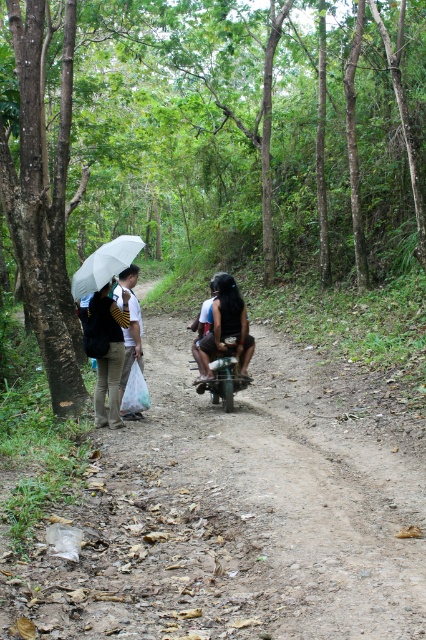
You are standing at the point labeled as point [238,512] in the image. What is the object directly beneath your feet?

The point labeled as point [238,512] corresponds to the dirt road at center.

You are a hiker who just arrived at the dirt road at center. You see a white matte bag at left. Which object is larger in size?

The dirt road at center is bigger than white matte bag at left.